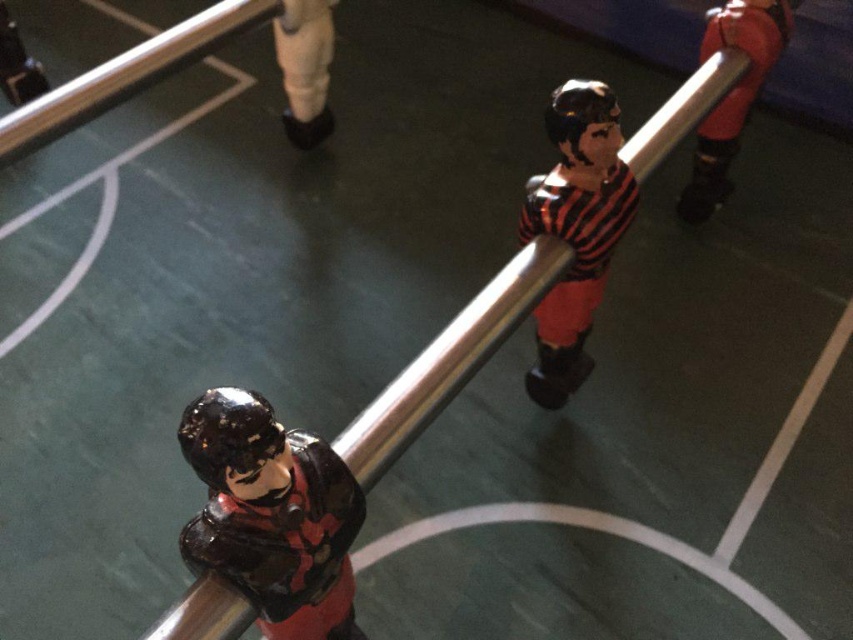
You are a player trying to score a goal in a foosball game. You notice the matte black figure at upper right and the white matte leg at upper center. Which object is narrower?

The matte black figure at upper right is narrower than the white matte leg at upper center.

Based on the photo, you are standing in front of the foosball table and want to reach the point at coordinates (724, 76) on the table. If your hand can extend 6 feet, will you be able to reach it?

The point at coordinates (724, 76) is 7.20 feet away from the viewer. Since your hand can only extend 6 feet, you cannot reach it.

You are a player trying to score a goal in the foosball game. You notice the metallic silver pole at center and the white matte leg at upper center. Which object is positioned lower on the table?

The metallic silver pole at center is below the white matte leg at upper center, so the metallic silver pole at center is positioned lower on the table.